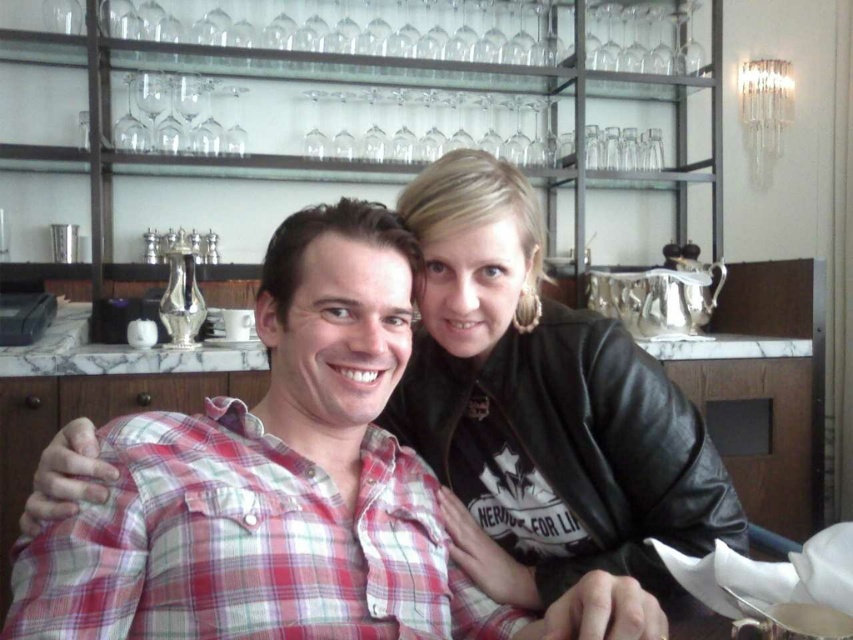
Does plaid cotton shirt at center appear on the right side of black leather jacket at upper right?

In fact, plaid cotton shirt at center is to the left of black leather jacket at upper right.

Who is positioned more to the left, plaid cotton shirt at center or black leather jacket at upper right?

plaid cotton shirt at center

At what (x,y) coordinates should I click in order to perform the action: click on plaid cotton shirt at center. Please return your answer as a coordinate pair (x, y). Looking at the image, I should click on point(289,488).